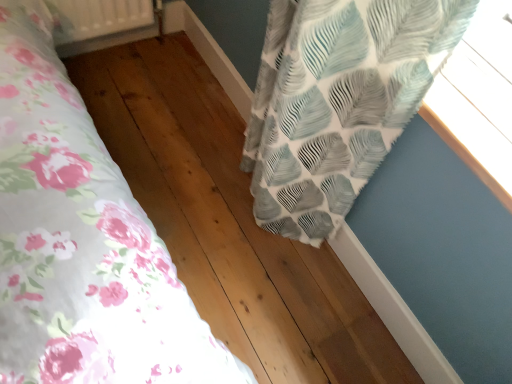
Where is `free space above textured white and blue leaf-patterned curtain at upper right (from a real-world perspective)`? free space above textured white and blue leaf-patterned curtain at upper right (from a real-world perspective) is located at coordinates (348, 214).